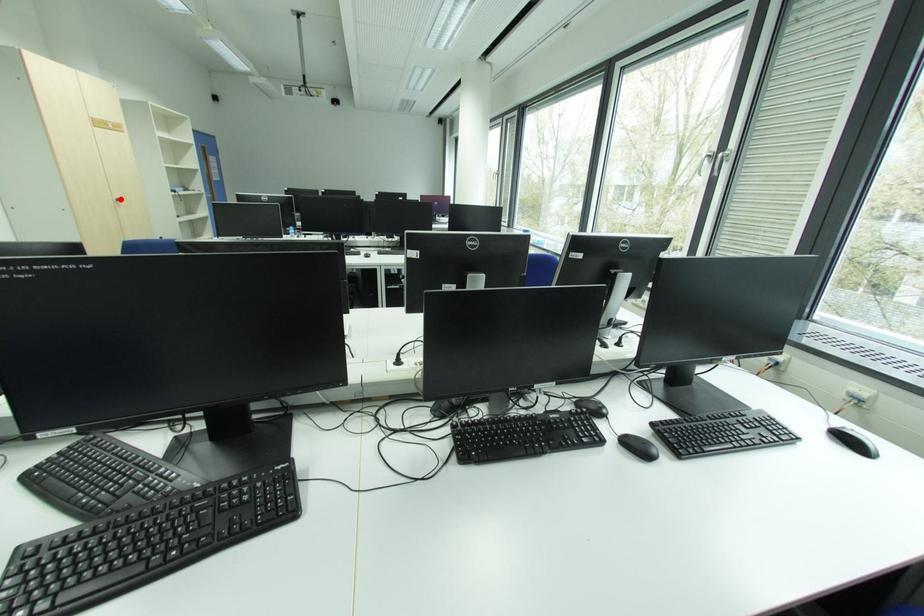
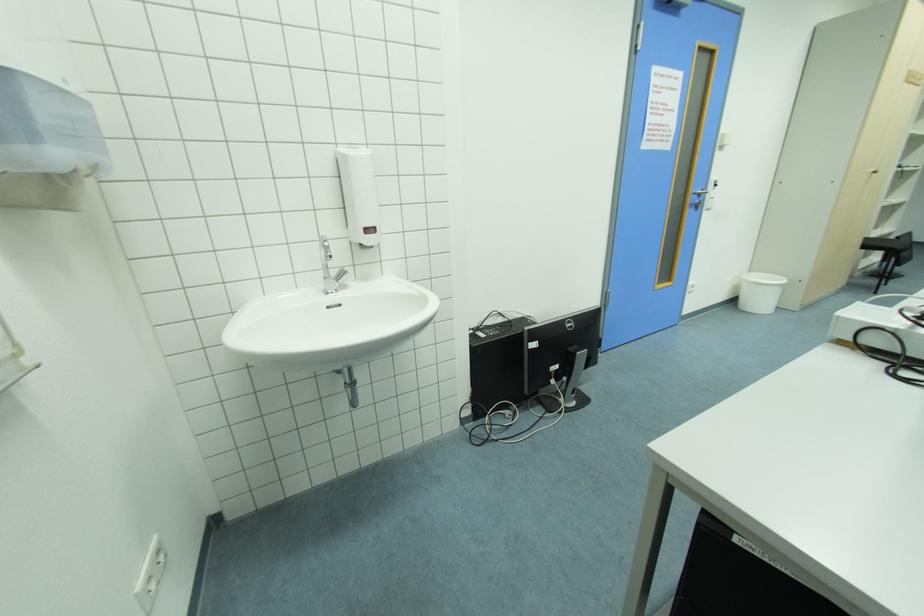
Where in the second image is the point corresponding to the highlighted location from the first image?

(878, 172)